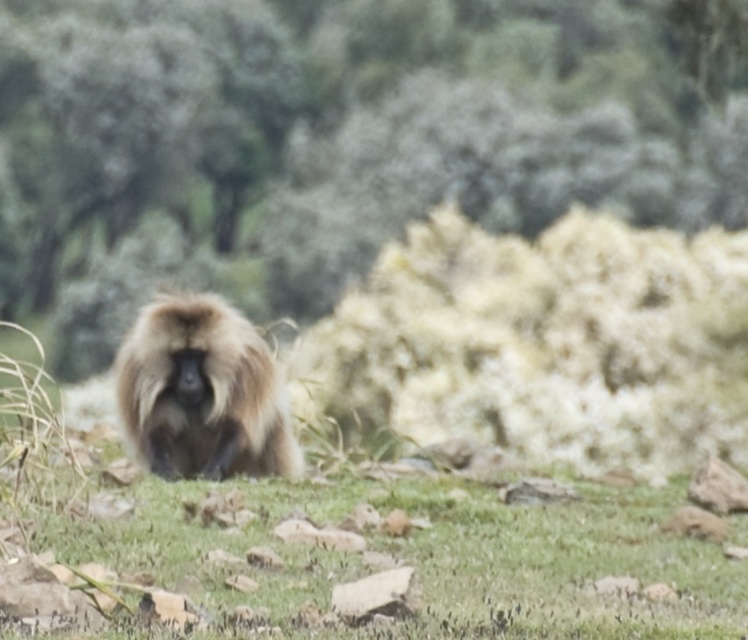
Which is behind, point (202, 236) or point (200, 452)?

The point (202, 236) is behind.

Measure the distance from green leafy tree at center to fuzzy brown monkey at center.

green leafy tree at center is 7.87 meters from fuzzy brown monkey at center.

Is point (4, 216) closer to viewer compared to point (162, 355)?

That is False.

What are the coordinates of `green leafy tree at center` in the screenshot? It's located at (340, 138).